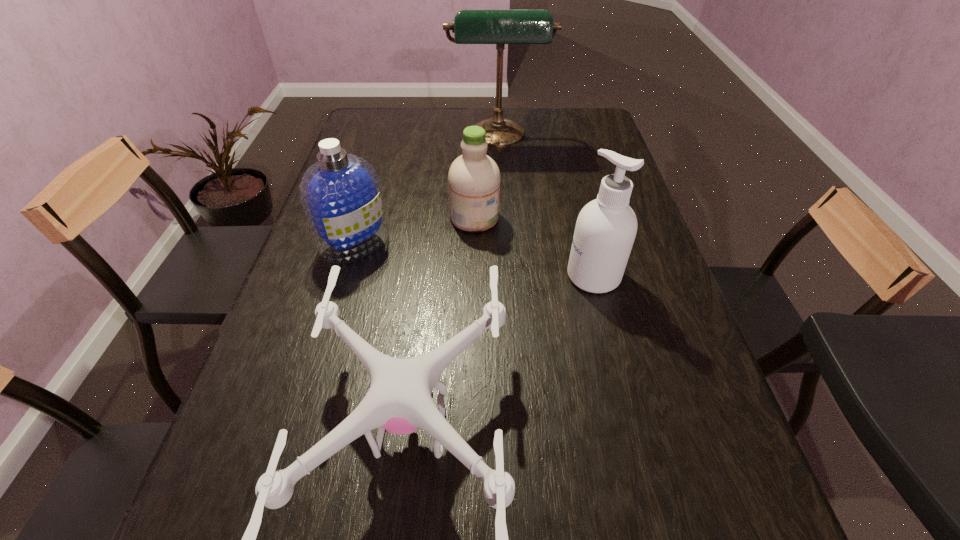
The image size is (960, 540). Find the location of `free space between the leftmost cleansing agent and the second cleansing agent from right to left`. free space between the leftmost cleansing agent and the second cleansing agent from right to left is located at coordinates (415, 230).

This screenshot has height=540, width=960. I want to click on blank region between the rightmost cleansing agent and the table lamp, so click(x=546, y=207).

Identify the location of free point between the rightmost cleansing agent and the second cleansing agent from right to left. (534, 247).

At what (x,y) coordinates should I click in order to perform the action: click on unoccupied area between the rightmost cleansing agent and the leftmost cleansing agent. Please return your answer as a coordinate pair (x, y). Looking at the image, I should click on pyautogui.click(x=474, y=259).

In order to click on object that ranks as the closest to the second cleansing agent from left to right in this screenshot , I will do `click(341, 196)`.

Identify the location of object that stands as the second closest to the nearest object. Image resolution: width=960 pixels, height=540 pixels. (606, 227).

Locate which cleansing agent is the third closest to the shortest object. Please provide its 2D coordinates. Your answer should be formatted as a tuple, i.e. [(x, y)], where the tuple contains the x and y coordinates of a point satisfying the conditions above.

[(474, 178)]

The image size is (960, 540). What are the coordinates of `cleansing agent that is the second closest to the farthest object` in the screenshot? It's located at (341, 196).